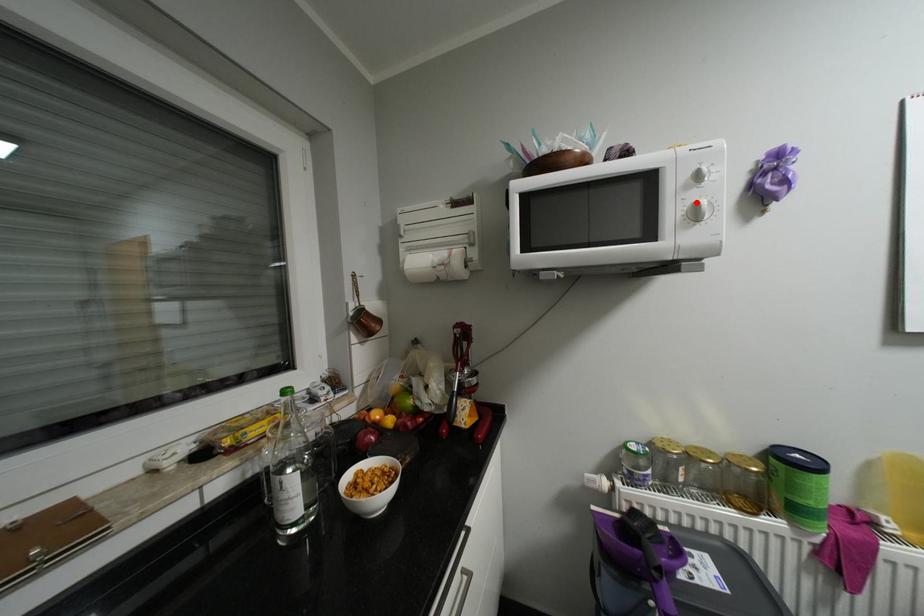
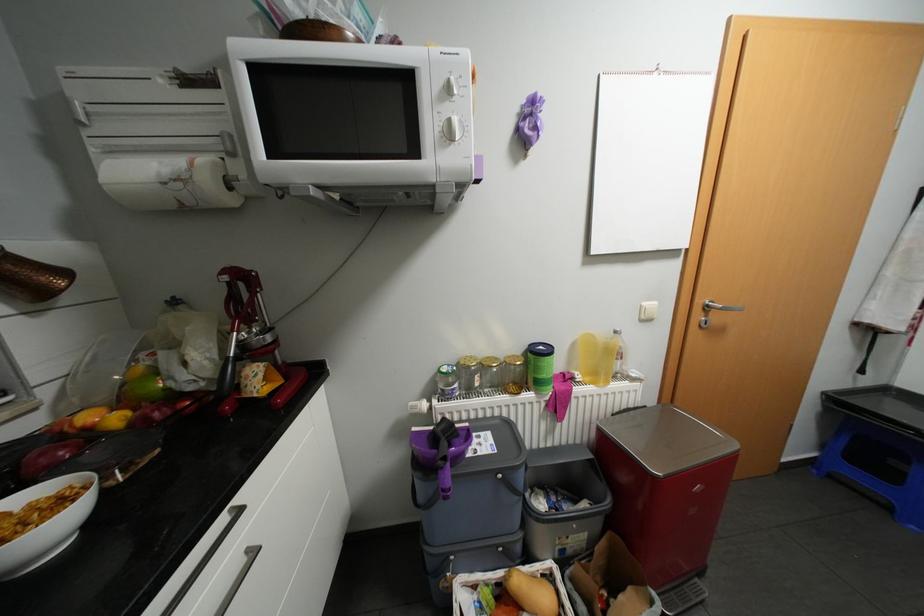
Locate, in the second image, the point that corresponds to the highlighted location in the first image.

(452, 116)